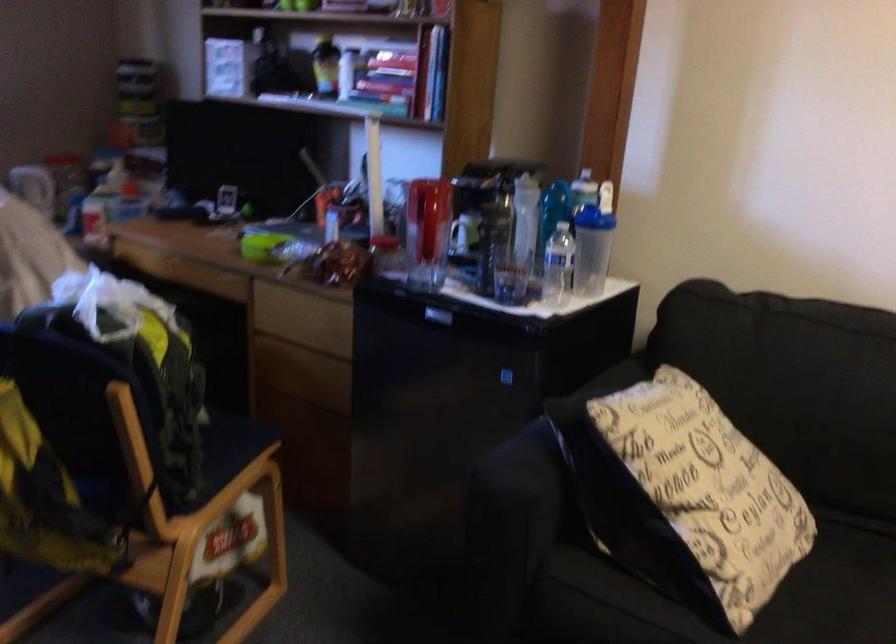
Find the location of `chair sitting surface`. chair sitting surface is located at coordinates (149, 564).